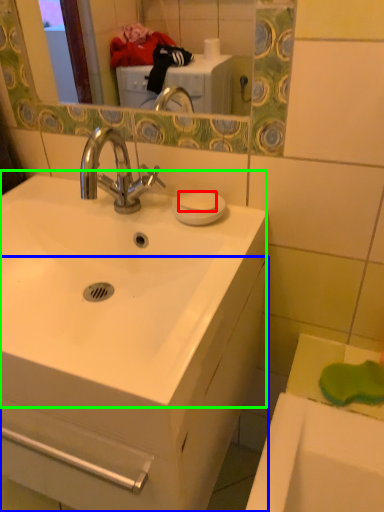
Question: Which object is positioned farthest from soap (highlighted by a red box)? Select from bathroom cabinet (highlighted by a blue box) and sink (highlighted by a green box).

Choices:
 (A) bathroom cabinet
 (B) sink

Answer: (A)